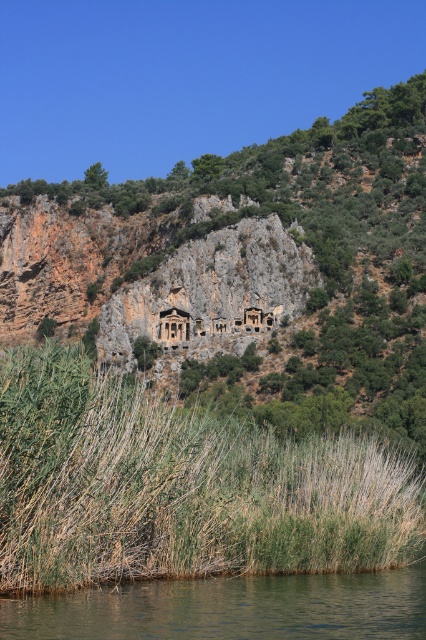
Question: Which point is closer to the camera taking this photo?

Choices:
 (A) (377, 316)
 (B) (210, 628)
 (C) (213, 531)
 (D) (166, 339)

Answer: (B)

Question: Does green grass at center have a larger size compared to matte stone tomb at center?

Choices:
 (A) yes
 (B) no

Answer: (A)

Question: Which point is farther to the camera?

Choices:
 (A) (199, 492)
 (B) (204, 305)

Answer: (B)

Question: Is green grassy reed at lower center below brown/rough water at lower center?

Choices:
 (A) yes
 (B) no

Answer: (B)

Question: Considering the relative positions of green grassy reed at lower center and matte stone tomb at center in the image provided, where is green grassy reed at lower center located with respect to matte stone tomb at center?

Choices:
 (A) right
 (B) left

Answer: (B)

Question: Which point is farther from the camera taking this photo?

Choices:
 (A) (374, 188)
 (B) (106, 586)
 (C) (186, 330)

Answer: (A)